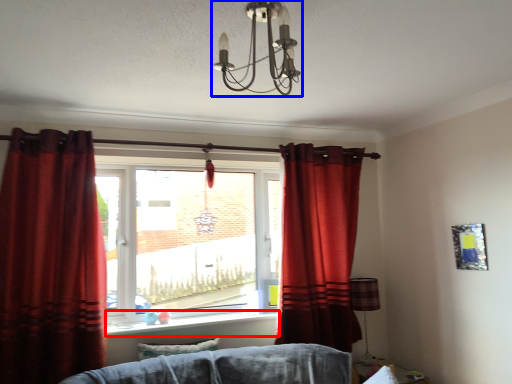
Question: Among these objects, which one is farthest to the camera, window sill (highlighted by a red box) or light fixture (highlighted by a blue box)?

Choices:
 (A) window sill
 (B) light fixture

Answer: (A)